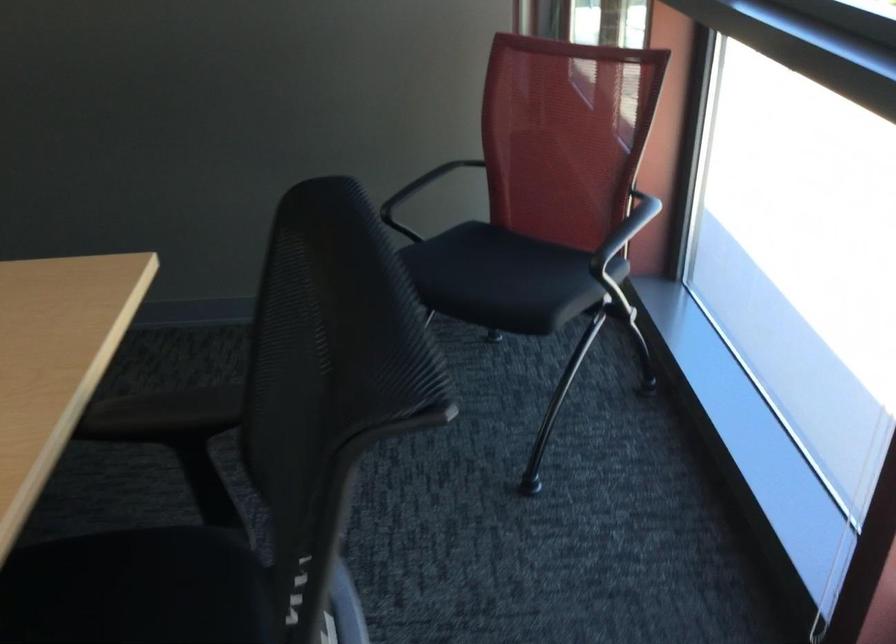
Question: The camera is either moving clockwise (left) or counter-clockwise (right) around the object. The first image is from the beginning of the video and the second image is from the end. Is the camera moving left or right when shooting the video?

Choices:
 (A) Left
 (B) Right

Answer: (B)